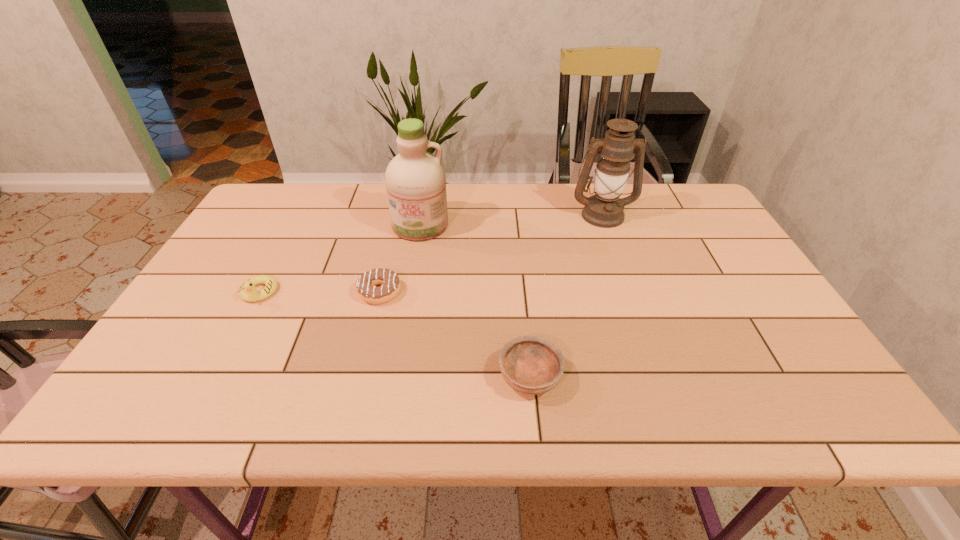
I want to click on vacant space that's between the second object from right to left and the doughnut, so click(455, 334).

This screenshot has width=960, height=540. In order to click on object that is the third closest to the rightmost object in this screenshot , I will do pos(366,287).

Identify the location of the fourth closest object to the leftmost object. (604, 209).

Identify the location of free spot that satisfies the following two spatial constraints: 1. on the face of the leftmost object; 2. on the left side of the bowl. Image resolution: width=960 pixels, height=540 pixels. (214, 376).

The height and width of the screenshot is (540, 960). Identify the location of vacant region that satisfies the following two spatial constraints: 1. on the face of the duckling; 2. on the right side of the second object from right to left. (214, 376).

In order to click on vacant space that satisfies the following two spatial constraints: 1. on the front label of the second object from right to left; 2. on the right side of the cleansing agent in this screenshot , I will do `click(395, 376)`.

This screenshot has width=960, height=540. Identify the location of vacant area in the image that satisfies the following two spatial constraints: 1. on the front side of the doughnut; 2. on the left side of the bowl. (359, 376).